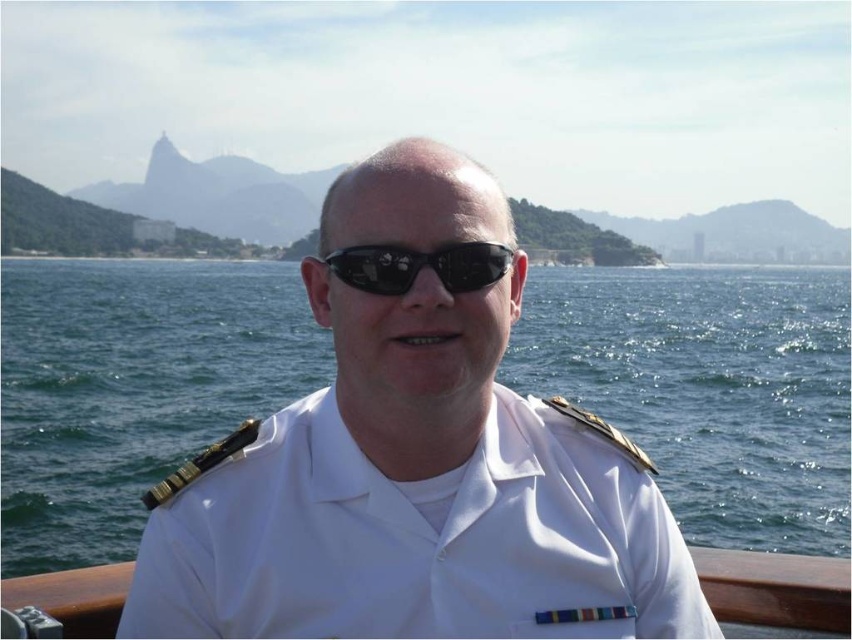
Who is more forward, (433, 496) or (349, 284)?

Positioned in front is point (433, 496).

The height and width of the screenshot is (640, 852). Describe the element at coordinates (416, 468) in the screenshot. I see `white uniform at center` at that location.

Locate an element on the screen. This screenshot has height=640, width=852. white uniform at center is located at coordinates (416, 468).